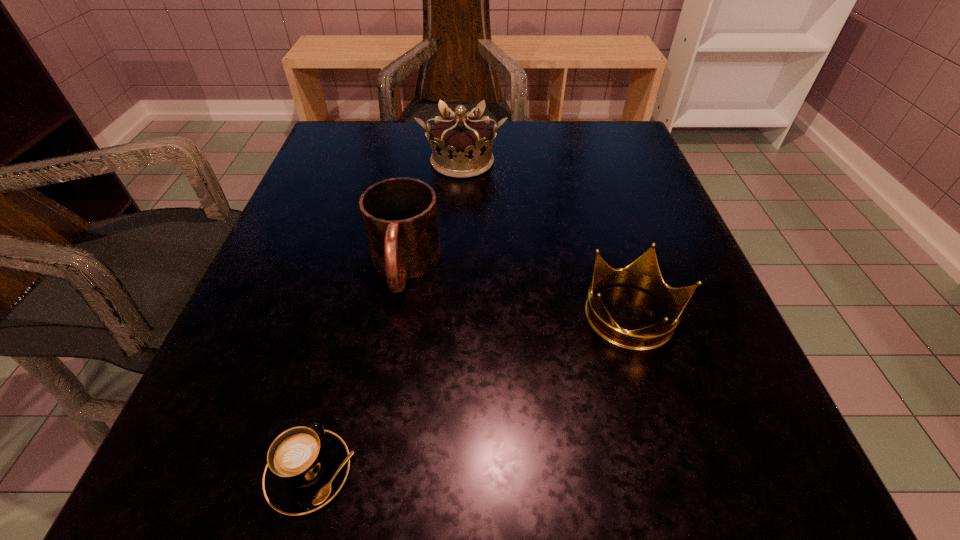
At what (x,y) coordinates should I click in order to perform the action: click on empty space that is in between the nearest object and the mug. Please return your answer as a coordinate pair (x, y). Looking at the image, I should click on (357, 369).

Choose which object is the third nearest neighbor to the farther crown. Please provide its 2D coordinates. Your answer should be formatted as a tuple, i.e. [(x, y)], where the tuple contains the x and y coordinates of a point satisfying the conditions above.

[(306, 467)]

Locate which object is the closest to the cappuccino. Please provide its 2D coordinates. Your answer should be formatted as a tuple, i.e. [(x, y)], where the tuple contains the x and y coordinates of a point satisfying the conditions above.

[(400, 216)]